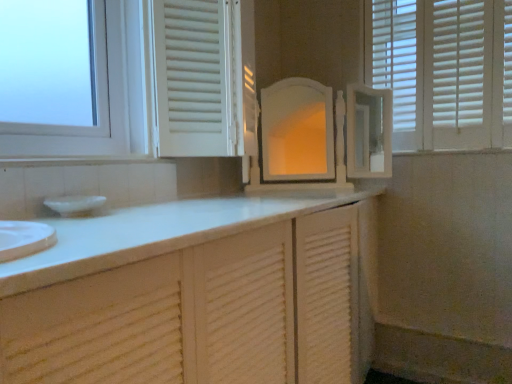
Question: Is the depth of white matte blinds at upper right greater than that of white glossy window sill at upper left?

Choices:
 (A) yes
 (B) no

Answer: (A)

Question: Can you confirm if white matte blinds at upper right is taller than white glossy window sill at upper left?

Choices:
 (A) no
 (B) yes

Answer: (B)

Question: Is white matte blinds at upper right bigger than white glossy window sill at upper left?

Choices:
 (A) no
 (B) yes

Answer: (B)

Question: Is white matte blinds at upper right outside white glossy window sill at upper left?

Choices:
 (A) no
 (B) yes

Answer: (B)

Question: Can you confirm if white matte blinds at upper right is wider than white glossy window sill at upper left?

Choices:
 (A) yes
 (B) no

Answer: (B)

Question: From a real-world perspective, is white matte blinds at upper right positioned under white glossy window sill at upper left based on gravity?

Choices:
 (A) yes
 (B) no

Answer: (B)

Question: Considering the relative sizes of white glossy window sill at upper left and white matte blinds at upper right in the image provided, is white glossy window sill at upper left smaller than white matte blinds at upper right?

Choices:
 (A) no
 (B) yes

Answer: (B)

Question: Considering the relative sizes of white glossy window sill at upper left and white matte blinds at upper right in the image provided, is white glossy window sill at upper left taller than white matte blinds at upper right?

Choices:
 (A) yes
 (B) no

Answer: (B)

Question: Does white glossy window sill at upper left touch white matte blinds at upper right?

Choices:
 (A) no
 (B) yes

Answer: (A)

Question: Is there a large distance between white glossy window sill at upper left and white matte blinds at upper right?

Choices:
 (A) no
 (B) yes

Answer: (B)

Question: Is white glossy window sill at upper left closer to the viewer compared to white matte blinds at upper right?

Choices:
 (A) no
 (B) yes

Answer: (B)

Question: Can you confirm if white glossy window sill at upper left is thinner than white matte blinds at upper right?

Choices:
 (A) no
 (B) yes

Answer: (A)

Question: Does point (15, 165) appear closer or farther from the camera than point (503, 49)?

Choices:
 (A) closer
 (B) farther

Answer: (A)